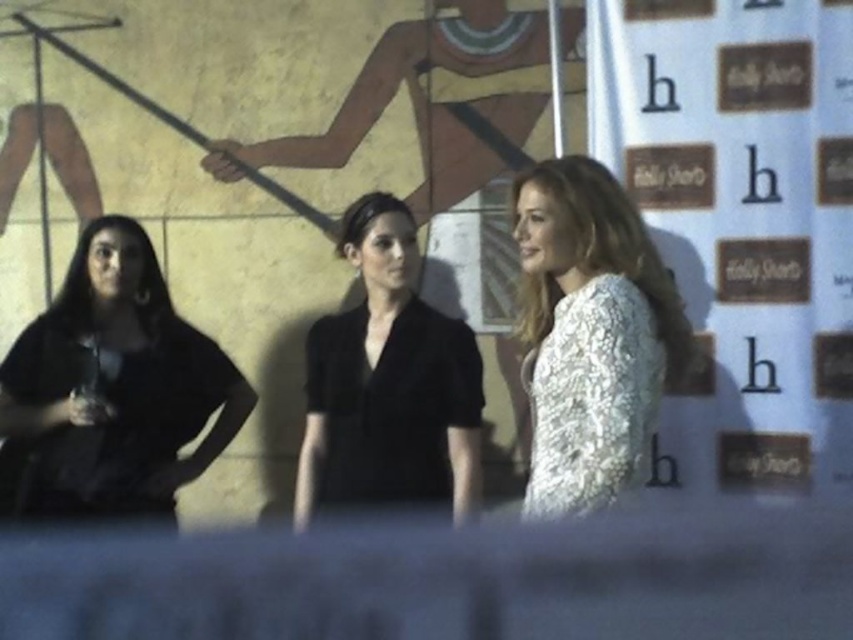
Question: Which point is closer to the camera taking this photo?

Choices:
 (A) (18, 358)
 (B) (445, 493)

Answer: (B)

Question: Observing the image, what is the correct spatial positioning of matte black dress at left in reference to white lace dress at center?

Choices:
 (A) above
 (B) below

Answer: (B)

Question: Which point appears closest to the camera in this image?

Choices:
 (A) (22, 353)
 (B) (550, 451)

Answer: (B)

Question: Observing the image, what is the correct spatial positioning of matte black dress at left in reference to black matte blazer at center?

Choices:
 (A) left
 (B) right

Answer: (A)

Question: Can you confirm if black matte blazer at center is positioned below smooth black blouse at center?

Choices:
 (A) yes
 (B) no

Answer: (A)

Question: Among these points, which one is nearest to the camera?

Choices:
 (A) [x=3, y=424]
 (B) [x=355, y=237]
 (C) [x=627, y=448]

Answer: (C)